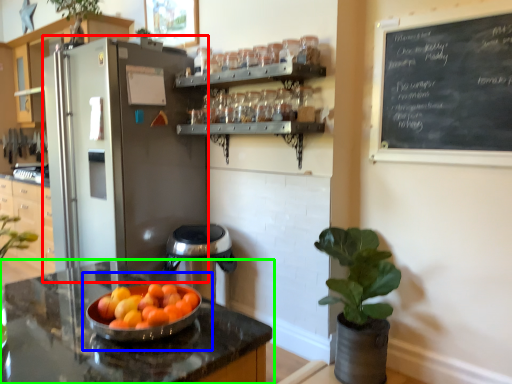
Question: Based on their relative distances, which object is nearer to appliance (highlighted by a red box)? Choose from fruit dish (highlighted by a blue box) and countertop (highlighted by a green box).

Choices:
 (A) fruit dish
 (B) countertop

Answer: (B)